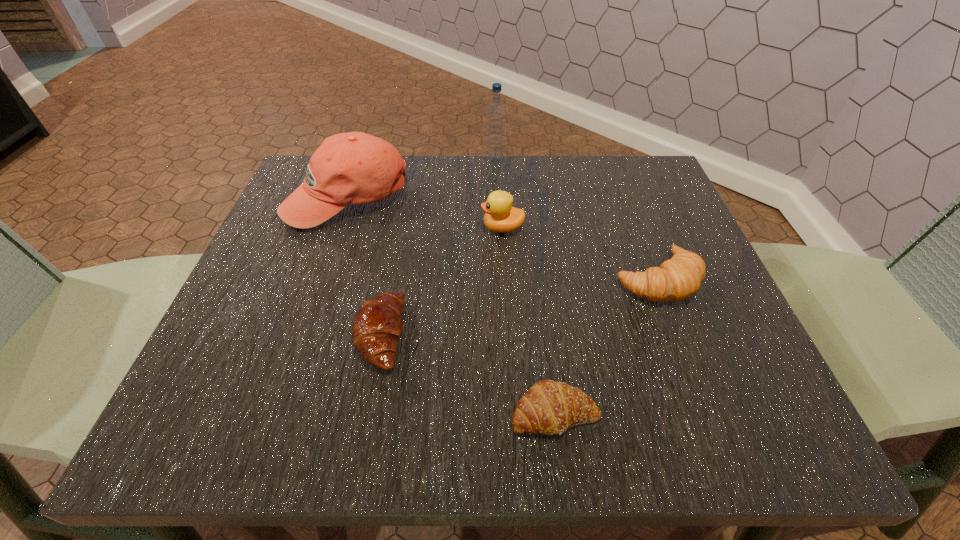
Find the location of a particular element. This screenshot has width=960, height=540. vacant point that satisfies the following two spatial constraints: 1. on the front side of the tallest object; 2. on the right side of the rightmost crescent roll is located at coordinates point(500,279).

You are a GUI agent. You are given a task and a screenshot of the screen. Output one action in this format:
    pyautogui.click(x=<x>, y=<y>)
    Task: Click on the vacant space that satisfies the following two spatial constraints: 1. on the face of the duckling; 2. on the right side of the nearest crescent roll
    The image size is (960, 540).
    Given the screenshot: What is the action you would take?
    pyautogui.click(x=513, y=414)

I want to click on free space that satisfies the following two spatial constraints: 1. on the back side of the fifth shortest object; 2. on the right side of the tallest object, so (x=361, y=160).

Locate an element on the screen. The image size is (960, 540). free space in the image that satisfies the following two spatial constraints: 1. on the face of the nearest object; 2. on the left side of the third tallest object is located at coordinates (513, 414).

This screenshot has width=960, height=540. Identify the location of free location that satisfies the following two spatial constraints: 1. on the face of the second crescent roll from right to left; 2. on the right side of the duckling. (513, 414).